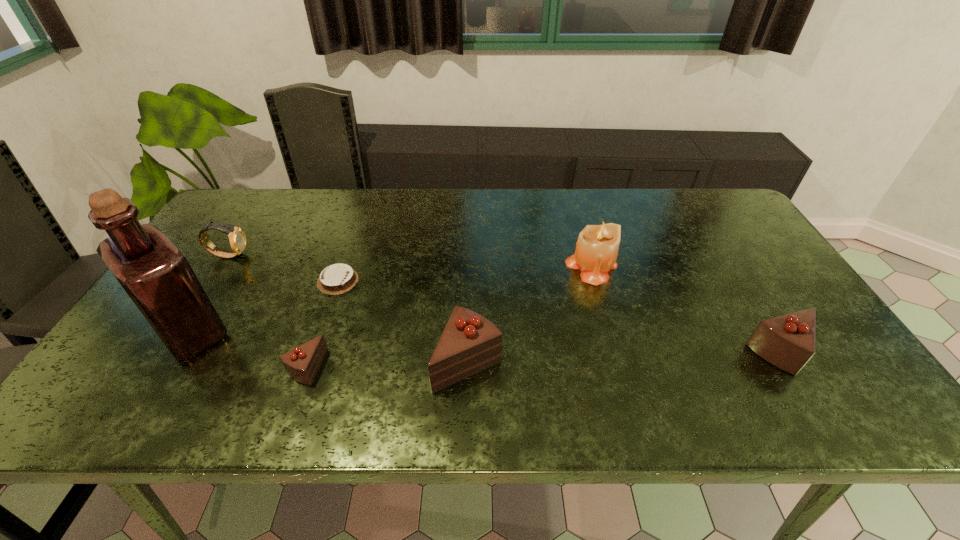
Where is `blank area located on the right of the second shortest object`? Image resolution: width=960 pixels, height=540 pixels. blank area located on the right of the second shortest object is located at coordinates (483, 367).

Locate an element on the screen. This screenshot has width=960, height=540. free space located on the left of the third chocolate cake from left to right is located at coordinates (342, 362).

You are a GUI agent. You are given a task and a screenshot of the screen. Output one action in this format:
    pyautogui.click(x=<x>, y=<y>)
    Task: Click on the free region located on the back of the third shortest chocolate cake
    
    Given the screenshot: What is the action you would take?
    pyautogui.click(x=722, y=256)

Image resolution: width=960 pixels, height=540 pixels. I want to click on vacant space positioned 0.350m on the right of the shortest chocolate cake, so click(x=486, y=281).

Where is `vacant region located 0.280m on the face of the watch`? vacant region located 0.280m on the face of the watch is located at coordinates (345, 255).

Where is `free space located 0.110m on the right of the second tallest object`? Image resolution: width=960 pixels, height=540 pixels. free space located 0.110m on the right of the second tallest object is located at coordinates (657, 266).

Find the location of a particular element. blank space located 0.120m on the back of the liquor is located at coordinates (228, 272).

The width and height of the screenshot is (960, 540). I want to click on liquor positioned at the near edge, so click(157, 277).

Image resolution: width=960 pixels, height=540 pixels. What are the coordinates of `watch at the left edge` in the screenshot? It's located at (237, 238).

Locate an element on the screen. This screenshot has width=960, height=540. liquor present at the left edge is located at coordinates (157, 277).